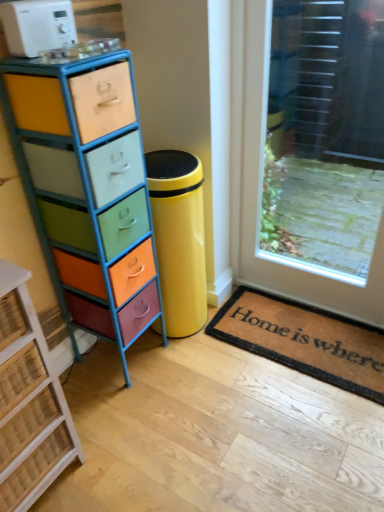
At what (x,y) coordinates should I click in order to perform the action: click on vacant space in front of multicolored painted wood chest of drawers at left, which is the 1th chest of drawers from right to left. Please return your answer as a coordinate pair (x, y). The width and height of the screenshot is (384, 512). Looking at the image, I should click on (124, 408).